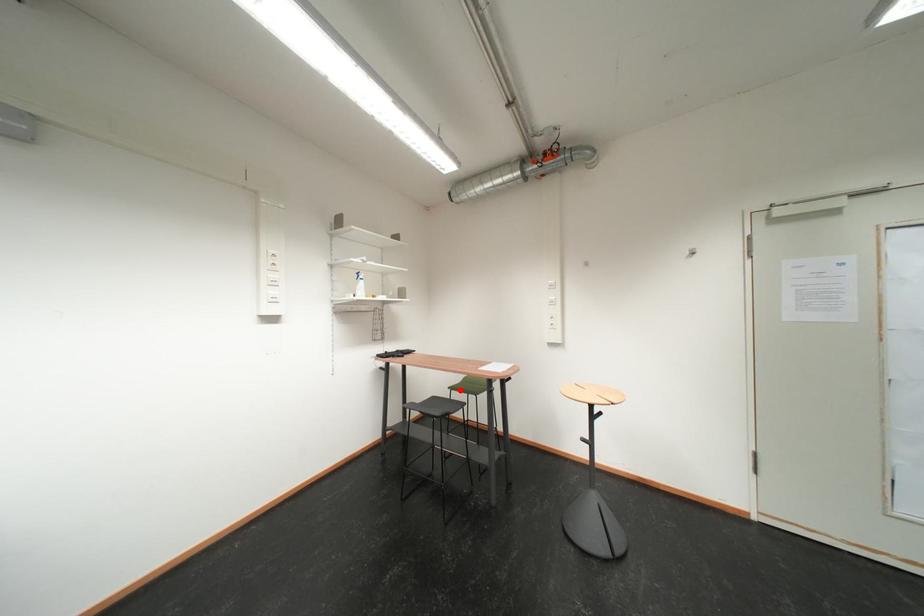
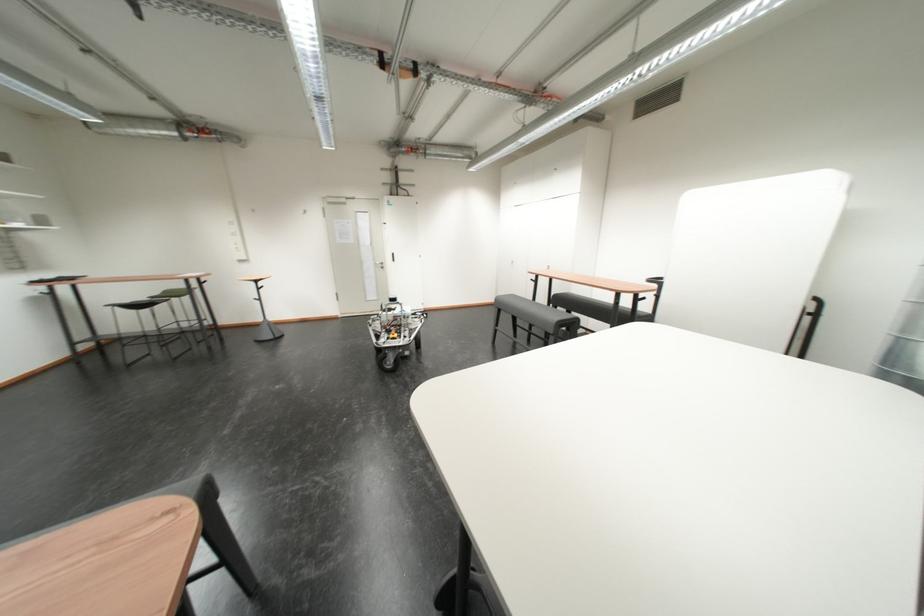
Question: I am providing you with two images of the same scene from different viewpoints. A red point is shown in image1. For the corresponding object point in image2, is it positioned nearer or farther from the camera?

Choices:
 (A) Nearer
 (B) Farther

Answer: (A)